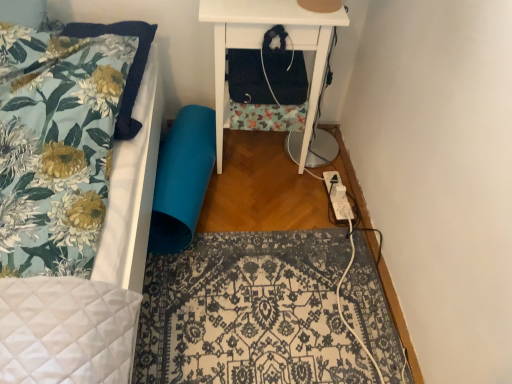
Find the location of a particular element. The width and height of the screenshot is (512, 384). empty space that is in between white plastic extension cord at lower right and teal fabric swivel chair at lower left is located at coordinates (264, 194).